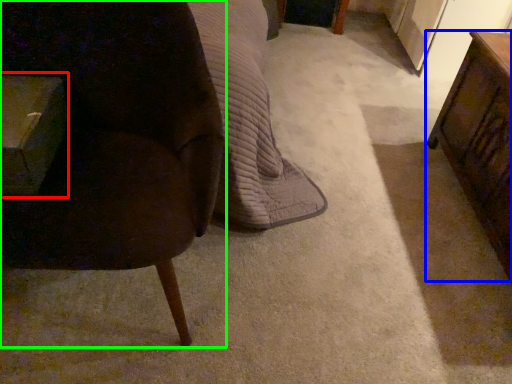
Question: Which object is positioned closest to table (highlighted by a red box)? Select from table (highlighted by a blue box) and chair (highlighted by a green box).

Choices:
 (A) table
 (B) chair

Answer: (B)